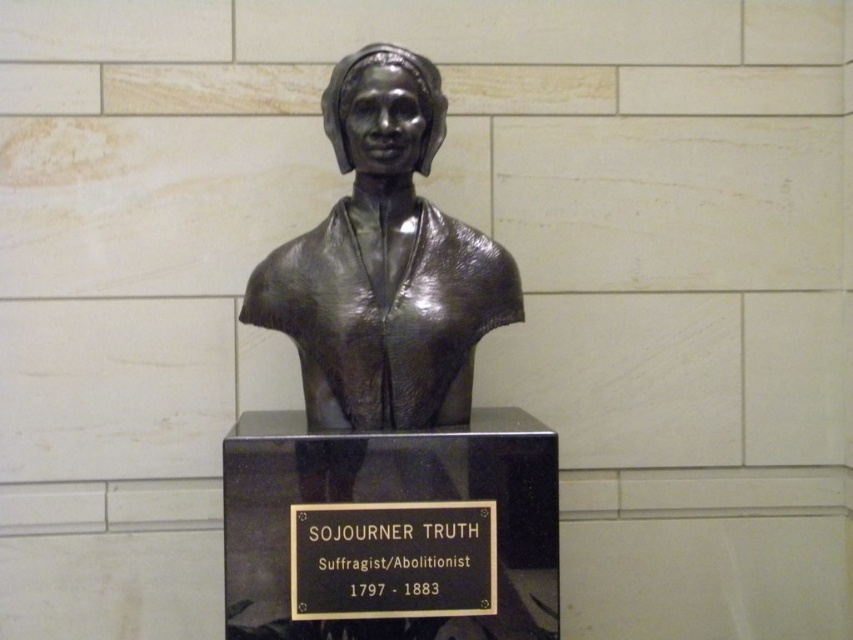
Does point (421, 284) lie in front of point (442, 611)?

No, it is behind (442, 611).

Is bronze/statue at center to the left of black metal plaque at center from the viewer's perspective?

Indeed, bronze/statue at center is positioned on the left side of black metal plaque at center.

The width and height of the screenshot is (853, 640). In order to click on bronze/statue at center in this screenshot , I will do `click(384, 264)`.